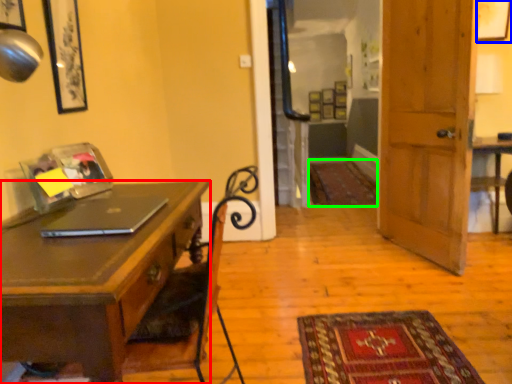
Question: Which object is the closest to the desk (highlighted by a red box)? Choose among these: picture frame (highlighted by a blue box) or mat (highlighted by a green box).

Choices:
 (A) picture frame
 (B) mat

Answer: (A)